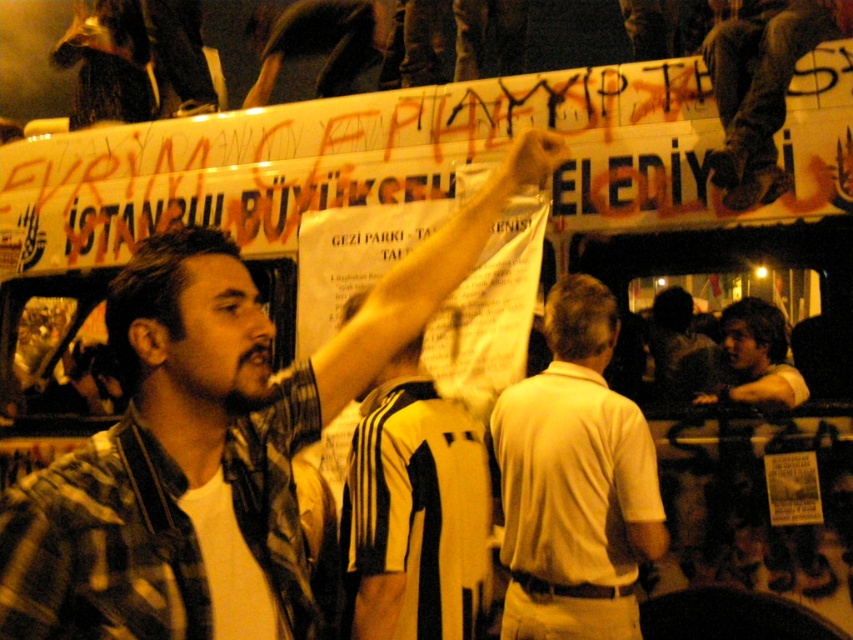
Question: Which is nearer to the white shirt at center?

Choices:
 (A) dark brown leather jacket at upper center
 (B) white matte shirt at center
 (C) black and white striped jersey at center
 (D) plaid shirt at center

Answer: (B)

Question: Which object is closer to the camera taking this photo?

Choices:
 (A) white matte shirt at center
 (B) dark brown leather pants at upper right
 (C) plaid shirt at center

Answer: (C)

Question: Does white matte shirt at center have a smaller size compared to white shirt at center?

Choices:
 (A) no
 (B) yes

Answer: (A)

Question: In this image, where is white matte shirt at center located relative to black and white striped jersey at center?

Choices:
 (A) below
 (B) above

Answer: (B)

Question: Can you confirm if black and white striped jersey at center is bigger than white shirt at center?

Choices:
 (A) yes
 (B) no

Answer: (A)

Question: Which of the following is the closest to the observer?

Choices:
 (A) (724, 396)
 (B) (474, 467)
 (C) (610, 605)

Answer: (B)